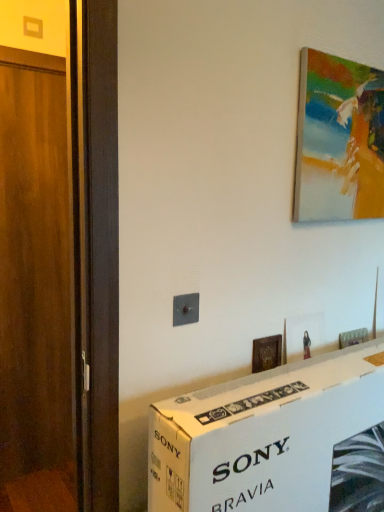
Question: Is painted canvas at upper right, the first picture frame when ordered from right to left, outside wooden door at left?

Choices:
 (A) yes
 (B) no

Answer: (A)

Question: Does painted canvas at upper right, the second picture frame when ordered from bottom to top, have a greater width compared to wooden door at left?

Choices:
 (A) no
 (B) yes

Answer: (A)

Question: From the image's perspective, is painted canvas at upper right, the first picture frame when ordered from right to left, located beneath wooden door at left?

Choices:
 (A) no
 (B) yes

Answer: (A)

Question: Does painted canvas at upper right, the first picture frame when ordered from top to bottom, have a greater height compared to wooden door at left?

Choices:
 (A) yes
 (B) no

Answer: (B)

Question: Is painted canvas at upper right, the second picture frame when ordered from bottom to top, surrounding wooden door at left?

Choices:
 (A) yes
 (B) no

Answer: (B)

Question: Is painted canvas at upper right, the second picture frame when ordered from bottom to top, closer to the viewer compared to wooden door at left?

Choices:
 (A) yes
 (B) no

Answer: (A)

Question: Is metallic switch at center aimed at wooden picture frame at center, the 1th picture frame when ordered from left to right?

Choices:
 (A) no
 (B) yes

Answer: (A)

Question: Is metallic switch at center shorter than wooden picture frame at center, which ranks as the 2th picture frame in top-to-bottom order?

Choices:
 (A) no
 (B) yes

Answer: (B)

Question: Is metallic switch at center placed right next to wooden picture frame at center, which ranks as the 2th picture frame in top-to-bottom order?

Choices:
 (A) yes
 (B) no

Answer: (B)

Question: Does metallic switch at center have a greater height compared to wooden picture frame at center, which is the 1th picture frame in bottom-to-top order?

Choices:
 (A) yes
 (B) no

Answer: (B)

Question: Is wooden picture frame at center, which is the 1th picture frame in bottom-to-top order, located within metallic switch at center?

Choices:
 (A) no
 (B) yes

Answer: (A)

Question: Is metallic switch at center closer to the viewer compared to wooden picture frame at center, which is the 1th picture frame in bottom-to-top order?

Choices:
 (A) no
 (B) yes

Answer: (B)

Question: Does wooden picture frame at center, which is the 1th picture frame in bottom-to-top order, have a smaller size compared to metallic switch at center?

Choices:
 (A) yes
 (B) no

Answer: (B)